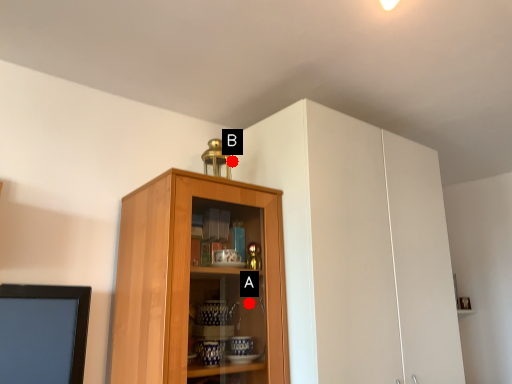
Question: Two points are circled on the image, labeled by A and B beside each circle. Among these points, which one is farthest from the camera?

Choices:
 (A) A is further
 (B) B is further

Answer: (B)